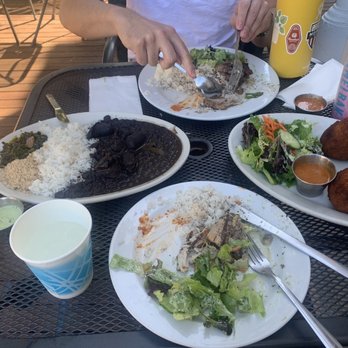
Where is `knives 2`? knives 2 is located at coordinates (316, 242).